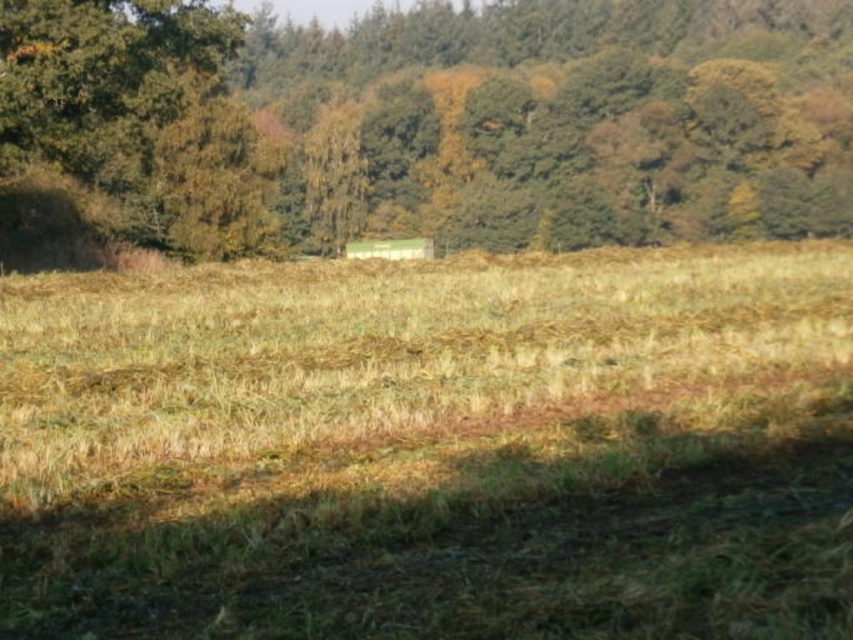
Question: Among these points, which one is farthest from the camera?

Choices:
 (A) (631, 560)
 (B) (408, 54)

Answer: (B)

Question: Does dry grass at center come behind green leafy tree at upper center?

Choices:
 (A) yes
 (B) no

Answer: (B)

Question: Which of the following is the farthest from the observer?

Choices:
 (A) (686, 33)
 (B) (165, 502)

Answer: (A)

Question: Does dry grass at center appear on the left side of green leafy tree at upper center?

Choices:
 (A) yes
 (B) no

Answer: (A)

Question: Where is dry grass at center located in relation to green leafy tree at upper center in the image?

Choices:
 (A) below
 (B) above

Answer: (A)